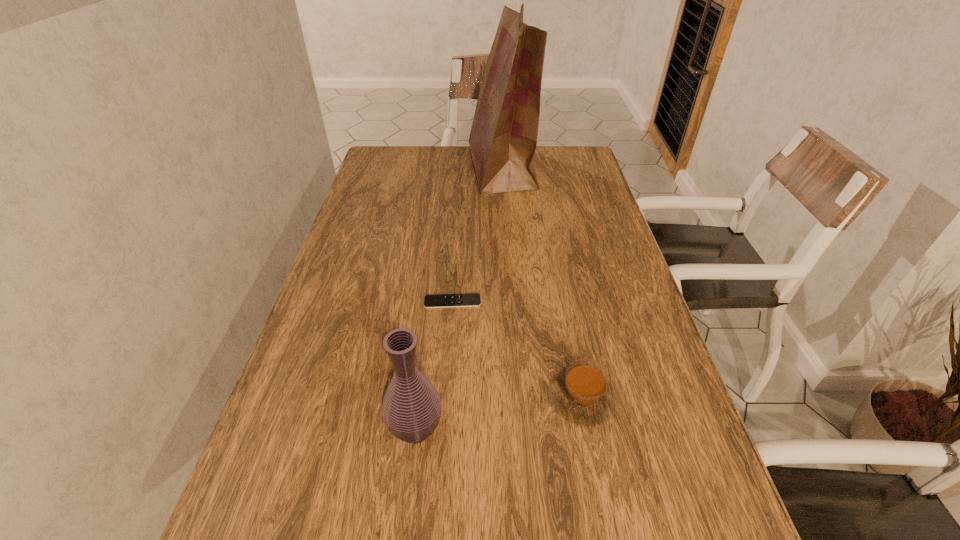
The height and width of the screenshot is (540, 960). What are the coordinates of `free spot between the second tallest object and the third nearest object` in the screenshot? It's located at (434, 366).

The image size is (960, 540). What are the coordinates of `free point between the vase and the second shortest object` in the screenshot? It's located at (499, 414).

Find the location of `free space between the second shortest object and the second farthest object`. free space between the second shortest object and the second farthest object is located at coordinates (517, 350).

Locate an element on the screen. free space that is in between the cappuccino and the remote control is located at coordinates (517, 350).

Find the location of a particular element. vacant area that lies between the remote control and the second shortest object is located at coordinates (517, 350).

This screenshot has height=540, width=960. I want to click on free space between the cappuccino and the tallest object, so click(542, 284).

At what (x,y) coordinates should I click in order to perform the action: click on free spot between the farthest object and the remote control. Please return your answer as a coordinate pair (x, y). This screenshot has height=540, width=960. Looking at the image, I should click on tap(477, 235).

Find the location of `vacant area between the vase and the second farthest object`. vacant area between the vase and the second farthest object is located at coordinates (434, 366).

This screenshot has width=960, height=540. In order to click on object that is the third closest to the third nearest object in this screenshot , I will do click(503, 138).

Select which object appears as the second closest to the cappuccino. Please provide its 2D coordinates. Your answer should be formatted as a tuple, i.e. [(x, y)], where the tuple contains the x and y coordinates of a point satisfying the conditions above.

[(467, 299)]